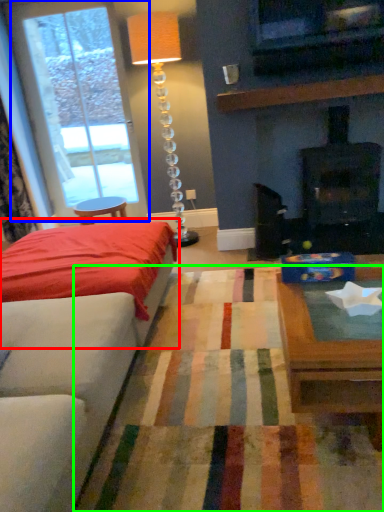
Question: Considering the real-world distances, which object is farthest from bed (highlighted by a red box)? window (highlighted by a blue box) or plain (highlighted by a green box)?

Choices:
 (A) window
 (B) plain

Answer: (A)